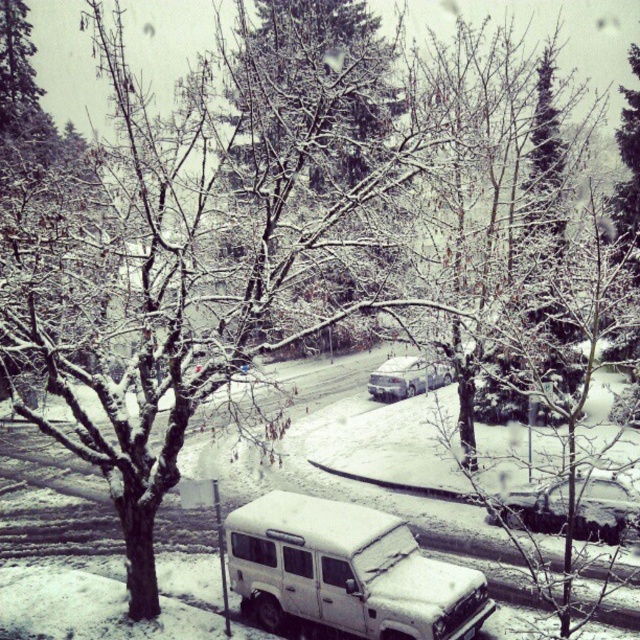
Question: Which of the following is the closest to the observer?

Choices:
 (A) 344,624
 (B) 392,394

Answer: (A)

Question: From the image, what is the correct spatial relationship of snow-covered white suv at lower center in relation to white matte sedan at center?

Choices:
 (A) right
 (B) left

Answer: (B)

Question: Can you confirm if snow-covered white suv at lower center is positioned to the left of snow-covered car at lower right?

Choices:
 (A) no
 (B) yes

Answer: (B)

Question: Which point is closer to the camera taking this photo?

Choices:
 (A) (369, 392)
 (B) (596, 502)

Answer: (B)

Question: Is snow-covered white suv at lower center positioned before snow-covered car at lower right?

Choices:
 (A) yes
 (B) no

Answer: (A)

Question: Which object is positioned farthest from the snow-covered car at lower right?

Choices:
 (A) white matte sedan at center
 (B) snow-covered white suv at lower center

Answer: (A)